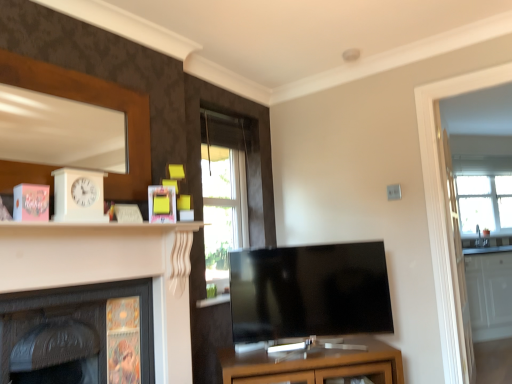
This screenshot has width=512, height=384. Find the location of `white glossy fireplace at left, positioned as the first fireplace in right-to-left order`. white glossy fireplace at left, positioned as the first fireplace in right-to-left order is located at coordinates (111, 272).

Locate an element on the screen. The width and height of the screenshot is (512, 384). clear glass window at right, the second window when ordered from front to back is located at coordinates (484, 192).

Image resolution: width=512 pixels, height=384 pixels. What do you see at coordinates (484, 192) in the screenshot?
I see `clear glass window at right, the second window when ordered from left to right` at bounding box center [484, 192].

Locate an element on the screen. This screenshot has width=512, height=384. transparent glass door at right is located at coordinates (450, 239).

From the image's perspective, between clear glass window at right, the second window when ordered from front to back, and clear glass window at center, placed as the second window when sorted from right to left, which one is located above?

clear glass window at center, placed as the second window when sorted from right to left.

Is clear glass window at right, which is the first window from right to left, directly adjacent to clear glass window at center, which is the first window in left-to-right order?

No.

Is clear glass window at right, placed as the 1th window when sorted from back to front, wider than clear glass window at center, positioned as the 2th window in back-to-front order?

No.

From a real-world perspective, is yellow matte picture frame at upper center physically located above or below transparent glass door at right?

yellow matte picture frame at upper center is above transparent glass door at right.

Is yellow matte picture frame at upper center oriented away from transparent glass door at right?

That's not correct — yellow matte picture frame at upper center is not looking away from transparent glass door at right.

Is yellow matte picture frame at upper center beside transparent glass door at right?

→ No, yellow matte picture frame at upper center is not making contact with transparent glass door at right.

Is yellow matte picture frame at upper center bigger than transparent glass door at right?

Incorrect, yellow matte picture frame at upper center is not larger than transparent glass door at right.

Does black glossy tv at center have a greater width compared to clear glass window at center, which is the first window in left-to-right order?

Indeed, black glossy tv at center has a greater width compared to clear glass window at center, which is the first window in left-to-right order.

Considering the relative sizes of black glossy tv at center and clear glass window at center, placed as the second window when sorted from right to left, in the image provided, is black glossy tv at center bigger than clear glass window at center, placed as the second window when sorted from right to left,?

Indeed, black glossy tv at center has a larger size compared to clear glass window at center, placed as the second window when sorted from right to left.

From the image's perspective, would you say black glossy tv at center is shown under clear glass window at center, placed as the second window when sorted from right to left?

Yes, from the image's perspective, black glossy tv at center is below clear glass window at center, placed as the second window when sorted from right to left.

Is clear glass window at right, the second window when ordered from left to right, situated inside matte brown cabinet at center or outside?

clear glass window at right, the second window when ordered from left to right, is located beyond the bounds of matte brown cabinet at center.

Is clear glass window at right, placed as the 1th window when sorted from back to front, positioned before matte brown cabinet at center?

No, the depth of clear glass window at right, placed as the 1th window when sorted from back to front, is greater than that of matte brown cabinet at center.

Based on the photo, considering the sizes of objects clear glass window at right, which is the first window from right to left, and matte brown cabinet at center in the image provided, who is wider, clear glass window at right, which is the first window from right to left, or matte brown cabinet at center?

matte brown cabinet at center is wider.

Is transparent glass door at right not near dark wood fireplace at lower left, which is the 2th fireplace from right to left?

transparent glass door at right is positioned a significant distance from dark wood fireplace at lower left, which is the 2th fireplace from right to left.

From a real-world perspective, relative to dark wood fireplace at lower left, which is the 2th fireplace from right to left, is transparent glass door at right vertically above or below?

transparent glass door at right is situated higher than dark wood fireplace at lower left, which is the 2th fireplace from right to left, in the real world.

Considering the positions of objects transparent glass door at right and dark wood fireplace at lower left, which is the 2th fireplace from right to left, in the image provided, who is more to the right, transparent glass door at right or dark wood fireplace at lower left, which is the 2th fireplace from right to left,?

transparent glass door at right is more to the right.

Considering the sizes of objects transparent glass door at right and dark wood fireplace at lower left, placed as the first fireplace when sorted from left to right, in the image provided, who is thinner, transparent glass door at right or dark wood fireplace at lower left, placed as the first fireplace when sorted from left to right,?

transparent glass door at right.

In order to click on the 1st window behind when counting from the dark wood fireplace at lower left, which is the 2th fireplace from right to left in this screenshot , I will do `click(224, 191)`.

Is clear glass window at center, which is the first window in left-to-right order, behind dark wood fireplace at lower left, which is the 2th fireplace from right to left?

Yes, clear glass window at center, which is the first window in left-to-right order, is further from the viewer.

Considering the relative positions of clear glass window at center, positioned as the 2th window in back-to-front order, and dark wood fireplace at lower left, which is the 2th fireplace from right to left, in the image provided, is clear glass window at center, positioned as the 2th window in back-to-front order, to the right of dark wood fireplace at lower left, which is the 2th fireplace from right to left, from the viewer's perspective?

Yes, clear glass window at center, positioned as the 2th window in back-to-front order, is to the right of dark wood fireplace at lower left, which is the 2th fireplace from right to left.

Does clear glass window at center, positioned as the 2th window in back-to-front order, turn towards dark wood fireplace at lower left, placed as the first fireplace when sorted from left to right?

No, clear glass window at center, positioned as the 2th window in back-to-front order, is not facing towards dark wood fireplace at lower left, placed as the first fireplace when sorted from left to right.

Is clear glass window at right, which is the first window from right to left, looking in the opposite direction of black glossy tv at center?

No, clear glass window at right, which is the first window from right to left, is not facing the opposite direction of black glossy tv at center.

Does clear glass window at right, the second window when ordered from left to right, lie behind black glossy tv at center?

Yes, clear glass window at right, the second window when ordered from left to right, is behind black glossy tv at center.

Between point (475, 158) and point (277, 306), which one is positioned in front?

Positioned in front is point (277, 306).

From the image's perspective, between clear glass window at right, the second window when ordered from left to right, and black glossy tv at center, who is located below?

black glossy tv at center, from the image's perspective.

Where is `window lying on the right of clear glass window at center, which is the first window in left-to-right order`? window lying on the right of clear glass window at center, which is the first window in left-to-right order is located at coordinates (484, 192).

Image resolution: width=512 pixels, height=384 pixels. Find the location of `glass door that appears below the yellow matte picture frame at upper center (from a real-world perspective)`. glass door that appears below the yellow matte picture frame at upper center (from a real-world perspective) is located at coordinates (450, 239).

Looking at the image, which one is located closer to dark wood fireplace at lower left, which is the 2th fireplace from right to left, yellow matte picture frame at upper center or black glossy tv at center?

yellow matte picture frame at upper center.

Estimate the real-world distances between objects in this image. Which object is further from clear glass window at right, the second window when ordered from left to right, transparent glass door at right or black glossy tv at center?

Based on the image, black glossy tv at center appears to be further to clear glass window at right, the second window when ordered from left to right.

From the image, which object appears to be nearer to transparent glass door at right, matte brown cabinet at center or clear glass window at center, marked as the 1th window in a front-to-back arrangement?

matte brown cabinet at center is positioned closer to the anchor transparent glass door at right.

Which object lies further to the anchor point black glossy tv at center, matte brown cabinet at center or clear glass window at center, marked as the 1th window in a front-to-back arrangement?

Among the two, clear glass window at center, marked as the 1th window in a front-to-back arrangement, is located further to black glossy tv at center.

Considering their positions, is transparent glass door at right positioned further to dark wood fireplace at lower left, which is the 2th fireplace from right to left, than black glossy tv at center?

transparent glass door at right is further to dark wood fireplace at lower left, which is the 2th fireplace from right to left.

Looking at the image, which one is located closer to white glossy fireplace at left, positioned as the first fireplace in right-to-left order, matte brown cabinet at center or dark wood fireplace at lower left, which is the 2th fireplace from right to left?

dark wood fireplace at lower left, which is the 2th fireplace from right to left, lies closer to white glossy fireplace at left, positioned as the first fireplace in right-to-left order, than the other object.

Considering their positions, is clear glass window at right, which is the first window from right to left, positioned further to transparent glass door at right than clear glass window at center, which is the first window in left-to-right order?

clear glass window at right, which is the first window from right to left, lies further to transparent glass door at right than the other object.

Estimate the real-world distances between objects in this image. Which object is further from black glossy tv at center, dark wood fireplace at lower left, placed as the first fireplace when sorted from left to right, or matte brown cabinet at center?

dark wood fireplace at lower left, placed as the first fireplace when sorted from left to right, lies further to black glossy tv at center than the other object.

I want to click on window situated between yellow matte picture frame at upper center and transparent glass door at right from left to right, so click(x=224, y=191).

Locate an element on the screen. The width and height of the screenshot is (512, 384). window between dark wood fireplace at lower left, which is the 2th fireplace from right to left, and clear glass window at right, which is the first window from right to left, in the horizontal direction is located at coordinates (224, 191).

At what (x,y) coordinates should I click in order to perform the action: click on cabinetry located between dark wood fireplace at lower left, placed as the first fireplace when sorted from left to right, and clear glass window at right, which is the first window from right to left, in the depth direction. Please return your answer as a coordinate pair (x, y). This screenshot has width=512, height=384. Looking at the image, I should click on (314, 364).

Where is `television between dark wood fireplace at lower left, which is the 2th fireplace from right to left, and matte brown cabinet at center`? Image resolution: width=512 pixels, height=384 pixels. television between dark wood fireplace at lower left, which is the 2th fireplace from right to left, and matte brown cabinet at center is located at coordinates (309, 292).